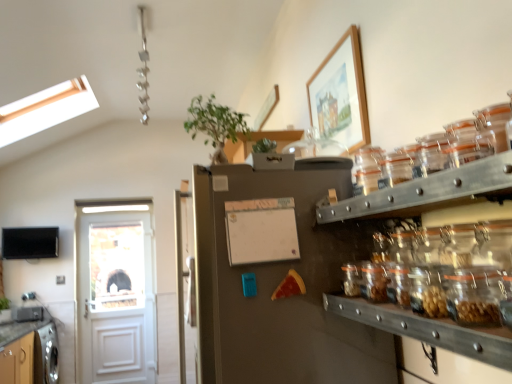
Question: Considering the relative sizes of green leafy plant at upper center and clear glass jars at center right in the image provided, is green leafy plant at upper center wider than clear glass jars at center right?

Choices:
 (A) yes
 (B) no

Answer: (A)

Question: Does green leafy plant at upper center come behind clear glass jars at center right?

Choices:
 (A) no
 (B) yes

Answer: (B)

Question: Is the depth of green leafy plant at upper center less than that of clear glass jars at center right?

Choices:
 (A) yes
 (B) no

Answer: (B)

Question: Can you confirm if green leafy plant at upper center is smaller than clear glass jars at center right?

Choices:
 (A) yes
 (B) no

Answer: (A)

Question: Could you tell me if green leafy plant at upper center is facing clear glass jars at center right?

Choices:
 (A) yes
 (B) no

Answer: (B)

Question: Considering the positions of point tap(289, 243) and point tap(44, 226), is point tap(289, 243) closer or farther from the camera than point tap(44, 226)?

Choices:
 (A) farther
 (B) closer

Answer: (B)

Question: Considering the positions of white matte bulletin board at center and flat screen tv at left in the image, is white matte bulletin board at center wider or thinner than flat screen tv at left?

Choices:
 (A) thin
 (B) wide

Answer: (A)

Question: Would you say white matte bulletin board at center is inside or outside flat screen tv at left?

Choices:
 (A) inside
 (B) outside

Answer: (B)

Question: Looking at the image, does white matte bulletin board at center seem bigger or smaller compared to flat screen tv at left?

Choices:
 (A) small
 (B) big

Answer: (A)

Question: Is white matte bulletin board at center bigger or smaller than wooden picture frame at upper center?

Choices:
 (A) small
 (B) big

Answer: (A)

Question: From a real-world perspective, relative to wooden picture frame at upper center, is white matte bulletin board at center vertically above or below?

Choices:
 (A) below
 (B) above

Answer: (A)

Question: Is white matte bulletin board at center to the left or to the right of wooden picture frame at upper center in the image?

Choices:
 (A) right
 (B) left

Answer: (B)

Question: Is white matte bulletin board at center wider or thinner than wooden picture frame at upper center?

Choices:
 (A) wide
 (B) thin

Answer: (B)

Question: Looking at their shapes, would you say satin silver fridge at center is wider or thinner than flat screen tv at left?

Choices:
 (A) thin
 (B) wide

Answer: (B)

Question: Considering the positions of satin silver fridge at center and flat screen tv at left in the image, is satin silver fridge at center bigger or smaller than flat screen tv at left?

Choices:
 (A) big
 (B) small

Answer: (A)